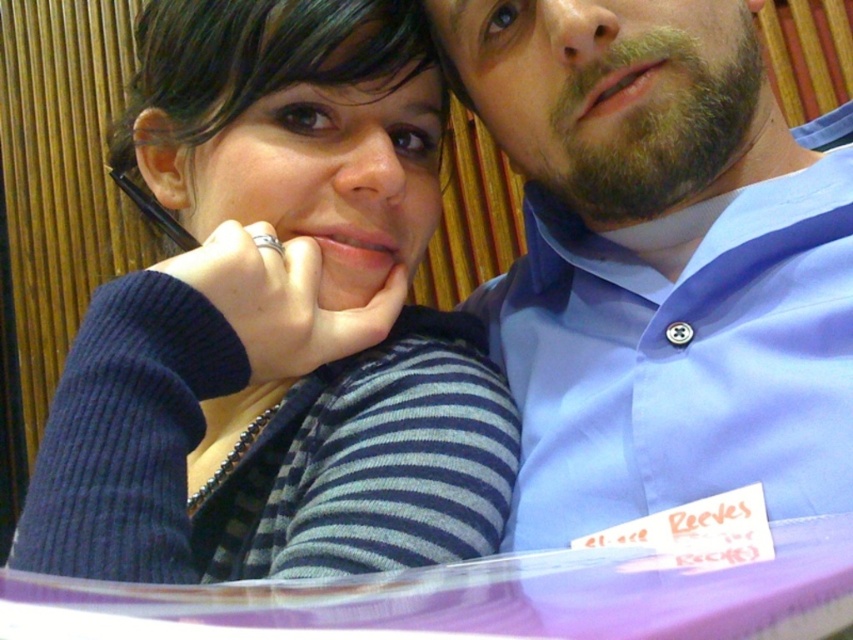
Question: Which point is closer to the camera?

Choices:
 (A) (181, 282)
 (B) (669, 308)

Answer: (A)

Question: Does ribbed blue sweater at center appear under blue button-down shirt at upper right?

Choices:
 (A) no
 (B) yes

Answer: (A)

Question: Is ribbed blue sweater at center thinner than blue button-down shirt at upper right?

Choices:
 (A) no
 (B) yes

Answer: (A)

Question: Can you confirm if ribbed blue sweater at center is positioned above blue button-down shirt at upper right?

Choices:
 (A) yes
 (B) no

Answer: (A)